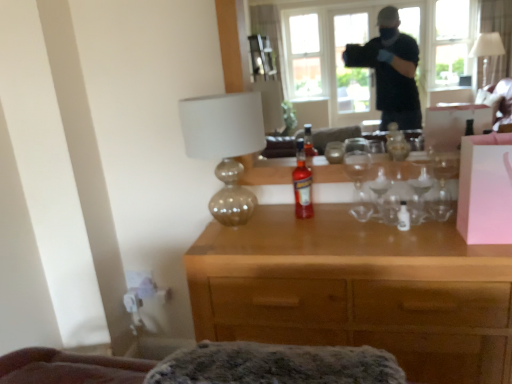
Where is `vacant area located to the right-hand side of translucent glass bottle at center`? The height and width of the screenshot is (384, 512). vacant area located to the right-hand side of translucent glass bottle at center is located at coordinates (345, 221).